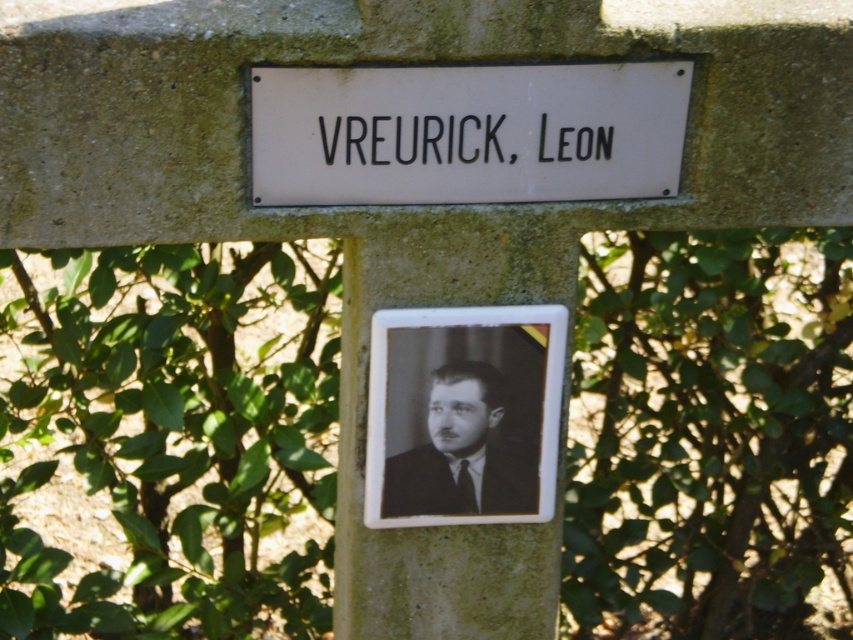
Is point (341, 173) in front of point (399, 115)?

That is False.

Can you confirm if white matte sign at center is taller than black text at center?

Yes, white matte sign at center is taller than black text at center.

Is point (606, 86) closer to viewer compared to point (479, 118)?

No.

At what (x,y) coordinates should I click in order to perform the action: click on white matte sign at center. Please return your answer as a coordinate pair (x, y). The image size is (853, 640). Looking at the image, I should click on (467, 132).

Between point (488, 412) and point (479, 140), which one is positioned behind?

Positioned behind is point (488, 412).

At what (x,y) coordinates should I click in order to perform the action: click on black matte portrait at center. Please return your answer as a coordinate pair (x, y). Image resolution: width=853 pixels, height=640 pixels. Looking at the image, I should click on (461, 452).

At what (x,y) coordinates should I click in order to perform the action: click on black matte portrait at center. Please return your answer as a coordinate pair (x, y). This screenshot has height=640, width=853. Looking at the image, I should click on (461, 452).

Identify the location of white matte sign at center. (467, 132).

Does white matte sign at center have a greater width compared to black matte portrait at center?

Indeed, white matte sign at center has a greater width compared to black matte portrait at center.

Locate an element on the screen. white matte sign at center is located at coordinates (467, 132).

Image resolution: width=853 pixels, height=640 pixels. What are the coordinates of `white matte sign at center` in the screenshot? It's located at (467, 132).